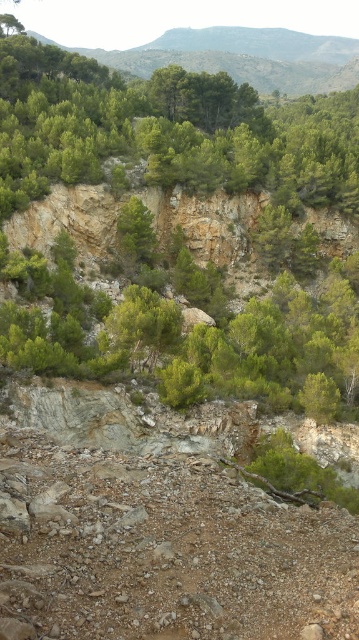
Question: Is brown gravel dirt track at lower center below green rough bark tree at center?

Choices:
 (A) no
 (B) yes

Answer: (B)

Question: Is brown gravel dirt track at lower center to the right of green matte tree at center from the viewer's perspective?

Choices:
 (A) no
 (B) yes

Answer: (B)

Question: Among these objects, which one is farthest from the camera?

Choices:
 (A) green matte tree at center
 (B) brown gravel dirt track at lower center

Answer: (A)

Question: Which of the following is the farthest from the observer?

Choices:
 (A) green matte tree at center
 (B) brown gravel dirt track at lower center

Answer: (A)

Question: Considering the relative positions of brown gravel dirt track at lower center and green matte tree at center in the image provided, where is brown gravel dirt track at lower center located with respect to green matte tree at center?

Choices:
 (A) right
 (B) left

Answer: (A)

Question: Which point is closer to the camera taking this photo?

Choices:
 (A) (117, 218)
 (B) (157, 336)
 (C) (77, 474)

Answer: (C)